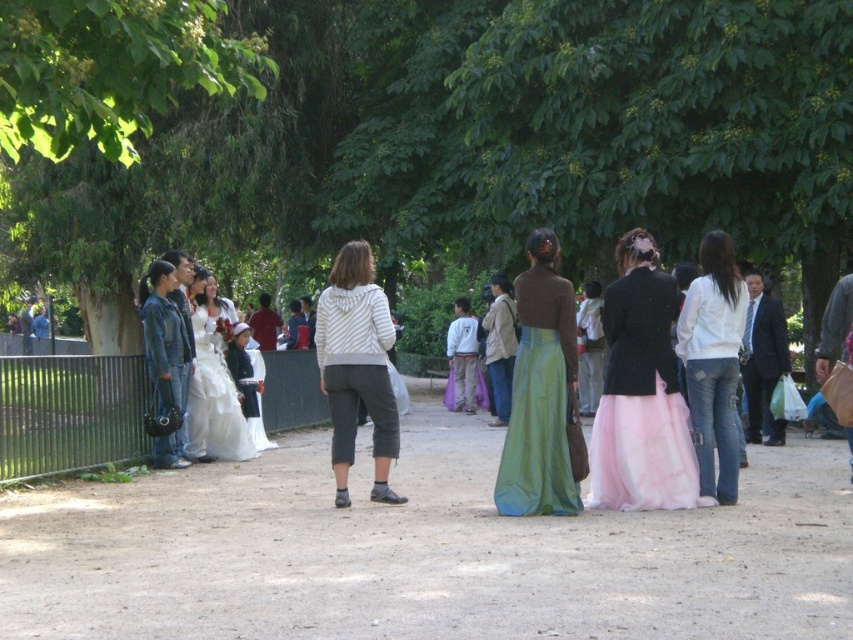
Based on the scene description, where is the green leafy tree at center located in terms of its 2D coordinates?

The green leafy tree at center is located at the 2D coordinates of point (x=431, y=140).

You are standing in the park and want to take a photo of both the point at coordinates (595,500) and the point at coordinates (514,394). Since you want both points to be in focus, which point should you focus on first to ensure the other is also sharp?

You should focus on the point at coordinates (595,500) first because it is closer to the camera than the point at coordinates (514,394). By focusing on the closer point, the farther one will also be in focus due to the depth of field.

Looking at this image, you are standing at the origin point of the coordinate system. You want to walk to the pink tulle skirt at center. Which direction should you go?

The pink tulle skirt at center is located at coordinate point 0.614 on the x axis and 0.753 on the y axis. Since you are at the origin, you should move towards the positive x and positive y direction to reach it.